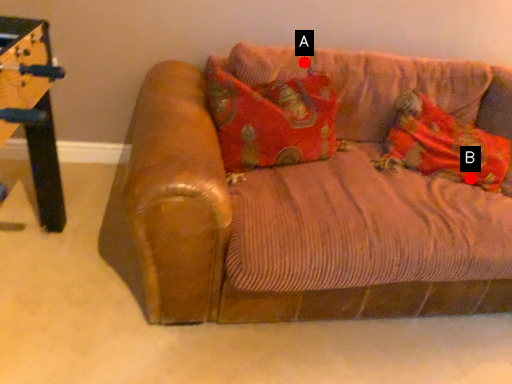
Question: Two points are circled on the image, labeled by A and B beside each circle. Which point appears closest to the camera in this image?

Choices:
 (A) A is closer
 (B) B is closer

Answer: (B)